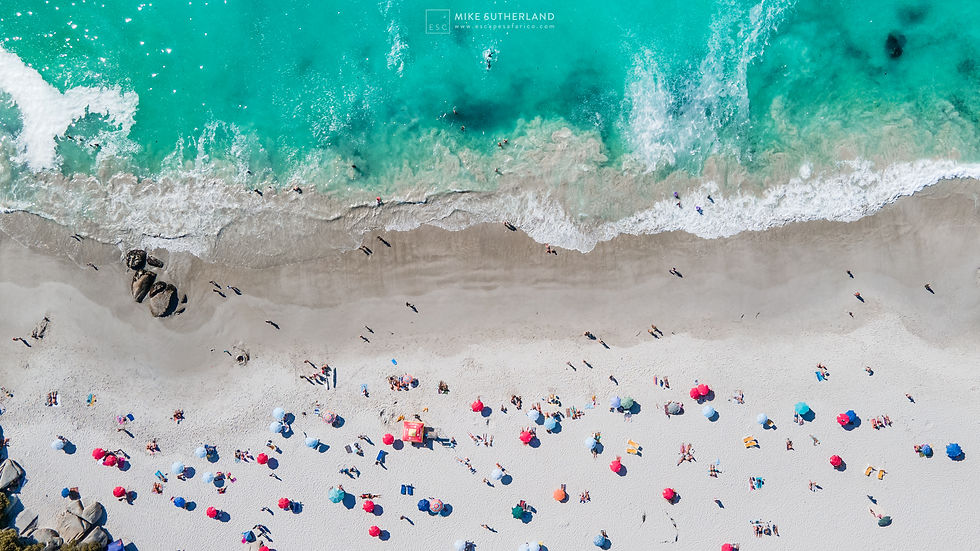
The image size is (980, 551). Identify the location of foam. (803, 209).